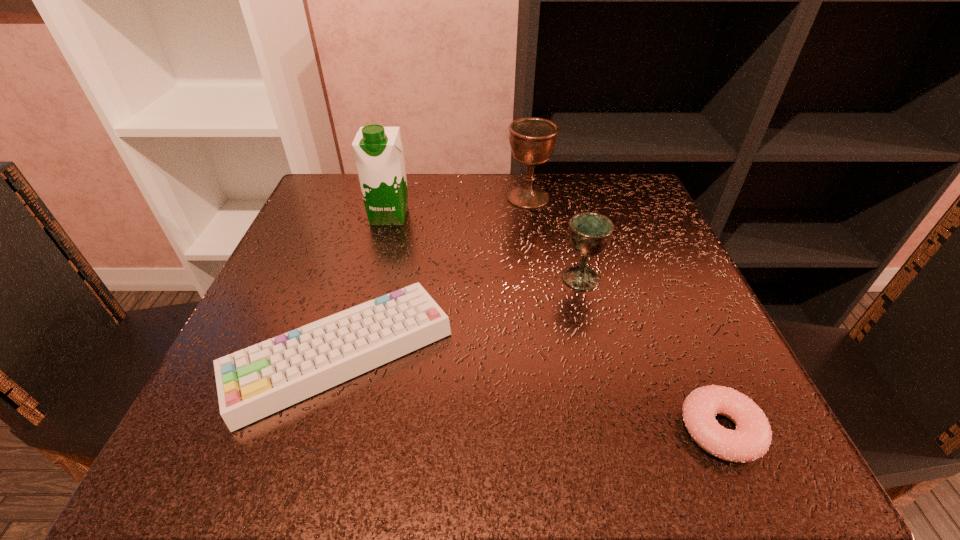
Find the location of a particular element. vacant space that's between the third shortest object and the computer keyboard is located at coordinates (460, 315).

You are a GUI agent. You are given a task and a screenshot of the screen. Output one action in this format:
    pyautogui.click(x=<x>, y=<y>)
    Task: Click on the free space between the nearer chalice and the rightmost object
    Image resolution: width=960 pixels, height=540 pixels.
    Given the screenshot: What is the action you would take?
    pyautogui.click(x=651, y=354)

What are the coordinates of `free space between the shorter chalice and the computer keyboard` in the screenshot? It's located at (460, 315).

Locate an element on the screen. The image size is (960, 540). vacant area that lies between the tallest object and the computer keyboard is located at coordinates (365, 284).

Find the location of a particular element. vacant space in between the shorter chalice and the tallest object is located at coordinates (485, 247).

I want to click on free space between the computer keyboard and the fourth shortest object, so click(x=434, y=275).

Image resolution: width=960 pixels, height=540 pixels. I want to click on vacant area between the third tallest object and the soya milk, so click(x=485, y=247).

Where is `unoccupied position between the soya milk and the rightmost object`? The image size is (960, 540). unoccupied position between the soya milk and the rightmost object is located at coordinates (555, 323).

Where is `empty space between the tallest object and the shorter chalice`? The height and width of the screenshot is (540, 960). empty space between the tallest object and the shorter chalice is located at coordinates (485, 247).

Locate an element on the screen. free point between the shortest object and the soya milk is located at coordinates (555, 323).